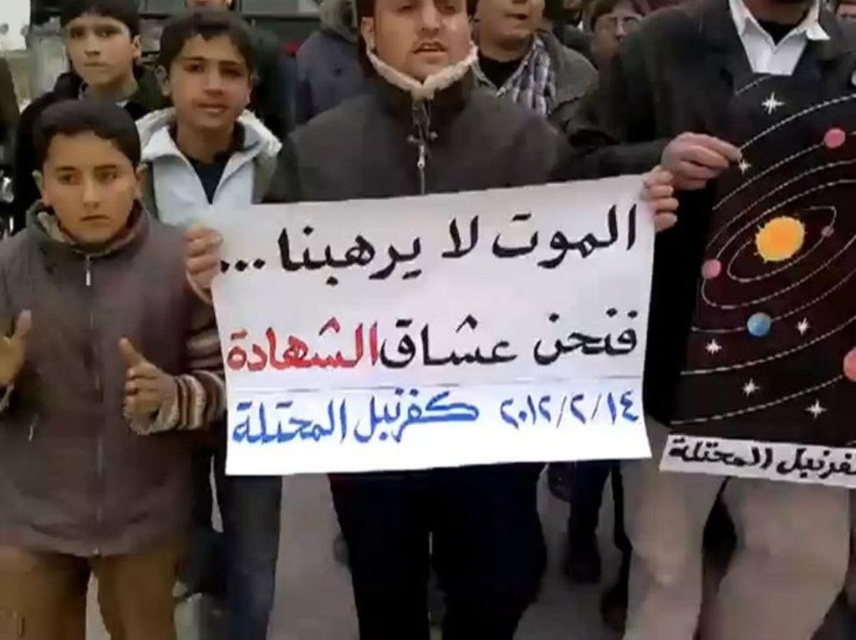
Question: Does dark brown sweater at center have a lesser width compared to matte black sign at center?

Choices:
 (A) no
 (B) yes

Answer: (A)

Question: Is dark brown sweater at center above matte black sign at center?

Choices:
 (A) no
 (B) yes

Answer: (B)

Question: Can you confirm if dark brown sweater at center is smaller than matte black sign at center?

Choices:
 (A) yes
 (B) no

Answer: (B)

Question: Which of the following is the farthest from the observer?

Choices:
 (A) pyautogui.click(x=603, y=99)
 (B) pyautogui.click(x=360, y=561)

Answer: (B)

Question: Which object appears farthest from the camera in this image?

Choices:
 (A) matte black sign at center
 (B) dark brown sweater at center

Answer: (A)